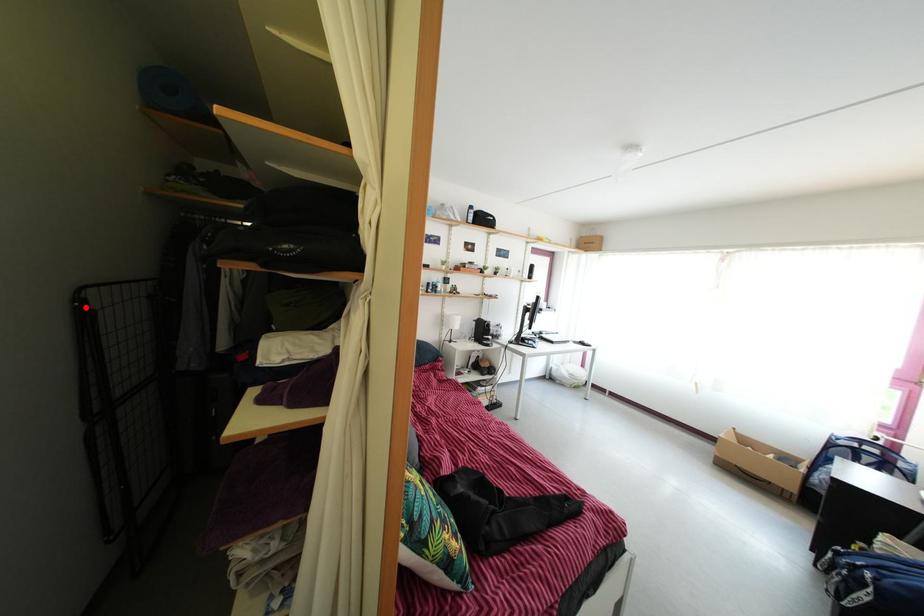
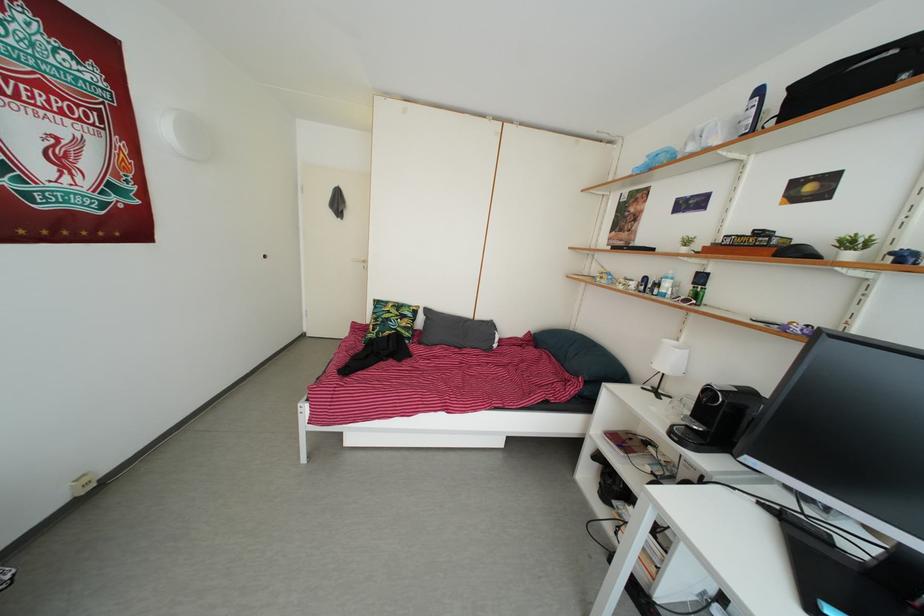
Question: I am providing you with two images of the same scene from different viewpoints. A red point is marked on the first image. At the location where the point appears in image 1, is it still visible in image 2?

Choices:
 (A) Yes
 (B) No

Answer: (B)